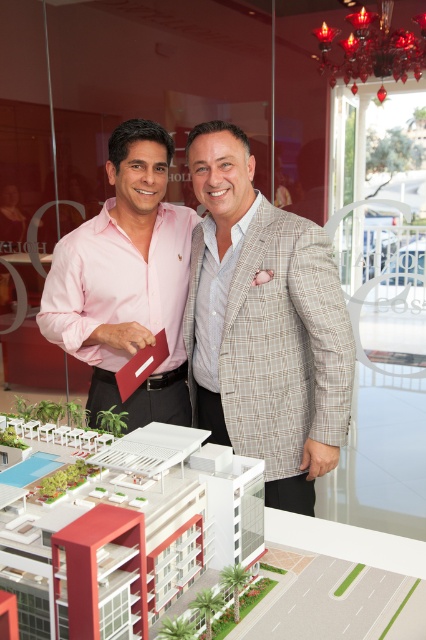
Is point (245, 243) in front of point (124, 344)?

Yes.

Does plaid wool blazer at center have a lesser height compared to pink cotton shirt at center?

No.

Which is in front, point (224, 248) or point (92, 314)?

Point (224, 248)

What are the coordinates of `plaid wool blazer at center` in the screenshot? It's located at (264, 324).